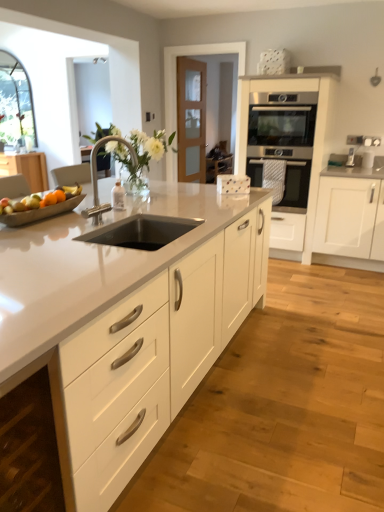
Locate an element on the screen. This screenshot has width=384, height=512. satin white oven at center, marked as the 2th cabinetry in a right-to-left arrangement is located at coordinates (315, 130).

Find the location of a particular element. silver metallic faucet at center is located at coordinates (97, 177).

This screenshot has width=384, height=512. What do you see at coordinates (345, 216) in the screenshot?
I see `white matte cabinet at right, marked as the 1th cabinetry in a right-to-left arrangement` at bounding box center [345, 216].

What do you see at coordinates (29, 449) in the screenshot? I see `white matte cabinet at lower left, which is the 3th cabinetry in right-to-left order` at bounding box center [29, 449].

What is the approximate height of stainless steel oven at center?

stainless steel oven at center is 60.33 centimeters tall.

I want to click on stainless steel oven at center, so click(x=296, y=183).

Where is `black stainless steel sink at center`? The width and height of the screenshot is (384, 512). black stainless steel sink at center is located at coordinates (141, 232).

Identify the location of satin white oven at center, marked as the 2th cabinetry in a right-to-left arrangement. The width and height of the screenshot is (384, 512). (315, 130).

From the image's perspective, which object appears higher, shiny metallic bowl at left or white matte cabinet at lower left, placed as the 1th cabinetry when sorted from front to back?

shiny metallic bowl at left.

Is point (4, 203) positioned behind point (53, 476)?

Yes.

Find the location of a particular element. This screenshot has height=512, width=384. cabinetry that is the 2nd object directly below the shiny metallic bowl at left (from a real-world perspective) is located at coordinates (29, 449).

Would you say white matte vase at center is outside white matte cabinet at lower left, the third cabinetry when ordered from back to front?

That's correct, white matte vase at center is outside of white matte cabinet at lower left, the third cabinetry when ordered from back to front.

Considering the sizes of objects white matte vase at center and white matte cabinet at lower left, the third cabinetry when ordered from back to front, in the image provided, who is shorter, white matte vase at center or white matte cabinet at lower left, the third cabinetry when ordered from back to front,?

white matte vase at center.

Can you tell me how much white matte vase at center and white matte cabinet at lower left, placed as the 1th cabinetry when sorted from front to back, differ in facing direction?

They differ by 173 degrees in their facing directions.

There is a white matte cabinet at lower left, placed as the 1th cabinetry when sorted from front to back. Identify the location of flower above it (from a real-world perspective). (140, 153).

Between black stainless steel sink at center and silver metallic faucet at center, which one has smaller width?

silver metallic faucet at center is thinner.

Which is behind, point (150, 238) or point (97, 200)?

The point (150, 238) is more distant.

I want to click on open in front of the silver metallic faucet at center, so click(141, 232).

Can you confirm if black stainless steel sink at center is positioned to the left of silver metallic faucet at center?

No, black stainless steel sink at center is not to the left of silver metallic faucet at center.

Is white matte vase at center completely or partially inside black stainless steel sink at center?

No.

From the image's perspective, is black stainless steel sink at center on white matte vase at center?

No, from the image's perspective, black stainless steel sink at center is not over white matte vase at center.

Is black stainless steel sink at center shorter than white matte vase at center?

Yes.

Is black stainless steel sink at center facing away from white matte vase at center?

No, black stainless steel sink at center's orientation is not away from white matte vase at center.

Is point (360, 202) farther from viewer compared to point (77, 472)?

That is True.

Who is bigger, white matte cabinet at right, the 2th cabinetry viewed from the back, or white glossy countertop at center?

With larger size is white glossy countertop at center.

Considering the relative sizes of white matte cabinet at right, the 2th cabinetry viewed from the back, and white glossy countertop at center in the image provided, is white matte cabinet at right, the 2th cabinetry viewed from the back, wider than white glossy countertop at center?

No, white matte cabinet at right, the 2th cabinetry viewed from the back, is not wider than white glossy countertop at center.

Is white matte cabinet at right, the 3th cabinetry from the left, at the right side of white glossy countertop at center?

Yes, white matte cabinet at right, the 3th cabinetry from the left, is to the right of white glossy countertop at center.

From a real-world perspective, does white matte vase at center stand above satin white oven at center, which is the 3th cabinetry in front-to-back order?

Indeed, from a real-world perspective, white matte vase at center stands above satin white oven at center, which is the 3th cabinetry in front-to-back order.

Is point (141, 146) positioned after point (333, 77)?

No, it is in front of (333, 77).

Does white matte vase at center turn towards satin white oven at center, which is the 3th cabinetry in front-to-back order?

No, white matte vase at center does not turn towards satin white oven at center, which is the 3th cabinetry in front-to-back order.

Is white matte vase at center not near satin white oven at center, positioned as the 2th cabinetry in left-to-right order?

Yes, white matte vase at center and satin white oven at center, positioned as the 2th cabinetry in left-to-right order, are located far from each other.

Locate an element on the screen. This screenshot has width=384, height=512. oven above the black stainless steel sink at center (from the image's perspective) is located at coordinates pos(296,183).

From the image's perspective, who appears lower, stainless steel oven at center or black stainless steel sink at center?

black stainless steel sink at center, from the image's perspective.

Does point (292, 198) appear closer or farther from the camera than point (189, 225)?

Clearly, point (292, 198) is more distant from the camera than point (189, 225).

Which is correct: stainless steel oven at center is inside black stainless steel sink at center, or outside of it?

stainless steel oven at center is not inside black stainless steel sink at center, it's outside.

Where is `fruit that is behind the white matte cabinet at lower left, the third cabinetry when ordered from back to front`? Image resolution: width=384 pixels, height=512 pixels. fruit that is behind the white matte cabinet at lower left, the third cabinetry when ordered from back to front is located at coordinates (45, 202).

I want to click on flower above the white matte cabinet at lower left, which is the 3th cabinetry in right-to-left order (from the image's perspective), so click(x=140, y=153).

Which object lies nearer to the anchor point white matte cabinet at lower left, the third cabinetry when ordered from back to front, stainless steel oven at center or black stainless steel sink at center?

black stainless steel sink at center is closer to white matte cabinet at lower left, the third cabinetry when ordered from back to front.

Based on their spatial positions, is white matte vase at center or silver metallic faucet at center closer to white glossy countertop at center?

silver metallic faucet at center lies closer to white glossy countertop at center than the other object.

Based on their spatial positions, is white matte cabinet at right, the 3th cabinetry from the left, or white glossy countertop at center further from stainless steel oven at center?

Among the two, white glossy countertop at center is located further to stainless steel oven at center.

When comparing their distances from stainless steel oven at center, does white matte vase at center or black stainless steel sink at center seem closer?

white matte vase at center.

Which object lies further to the anchor point silver metallic faucet at center, satin white oven at center, positioned as the 2th cabinetry in left-to-right order, or white glossy countertop at center?

satin white oven at center, positioned as the 2th cabinetry in left-to-right order, is further to silver metallic faucet at center.

Estimate the real-world distances between objects in this image. Which object is further from silver metallic faucet at center, black stainless steel sink at center or stainless steel oven at center?

The object further to silver metallic faucet at center is stainless steel oven at center.

Looking at the image, which one is located closer to white matte cabinet at right, the 2th cabinetry viewed from the back, white matte vase at center or shiny metallic bowl at left?

white matte vase at center.

Considering their positions, is white matte cabinet at right, marked as the 1th cabinetry in a right-to-left arrangement, positioned further to white matte vase at center than black stainless steel sink at center?

Based on the image, white matte cabinet at right, marked as the 1th cabinetry in a right-to-left arrangement, appears to be further to white matte vase at center.

Identify the location of flower between white matte cabinet at lower left, the third cabinetry when ordered from back to front, and white matte cabinet at right, marked as the 1th cabinetry in a right-to-left arrangement, in the front-back direction. pyautogui.click(x=140, y=153).

Image resolution: width=384 pixels, height=512 pixels. In order to click on tap between white matte cabinet at lower left, the first cabinetry positioned from the left, and satin white oven at center, marked as the 2th cabinetry in a right-to-left arrangement, in the front-back direction in this screenshot , I will do `click(97, 177)`.

This screenshot has width=384, height=512. I want to click on open between white glossy countertop at center and white matte cabinet at right, the 3th cabinetry from the left, along the z-axis, so click(141, 232).

Locate an element on the screen. Image resolution: width=384 pixels, height=512 pixels. tap between white matte cabinet at lower left, placed as the 1th cabinetry when sorted from front to back, and stainless steel oven at center from front to back is located at coordinates [x=97, y=177].